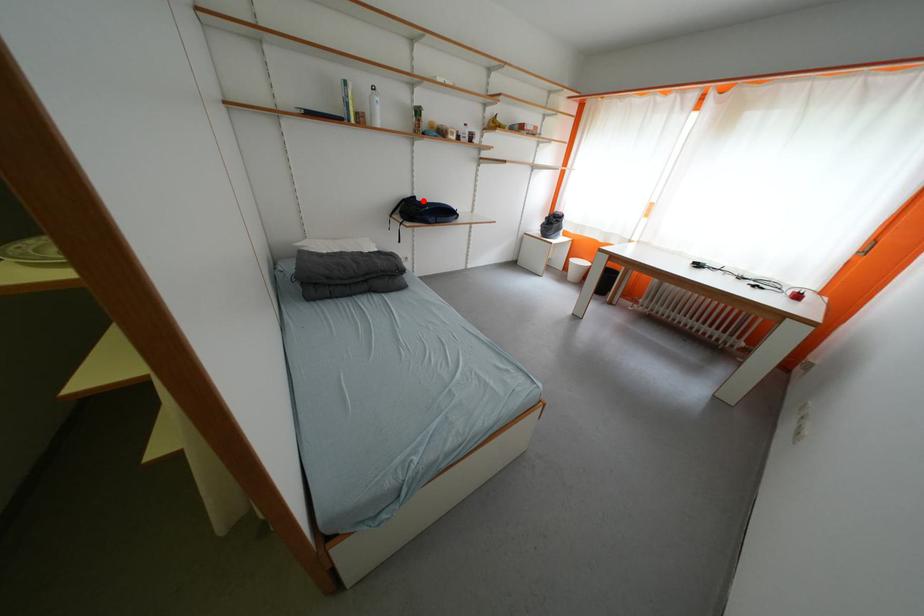
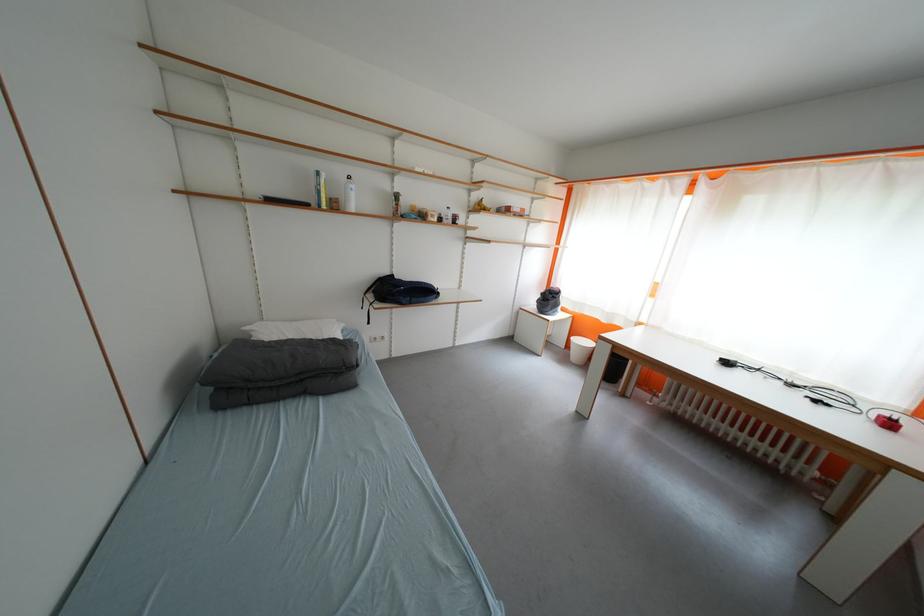
Where in the second image is the point corresponding to the highlighted location from the first image?

(400, 278)